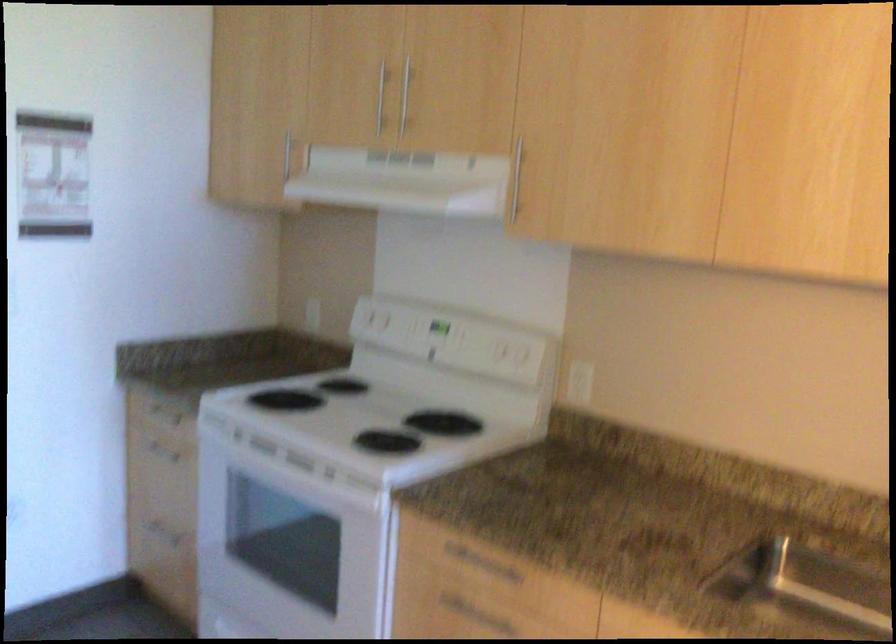
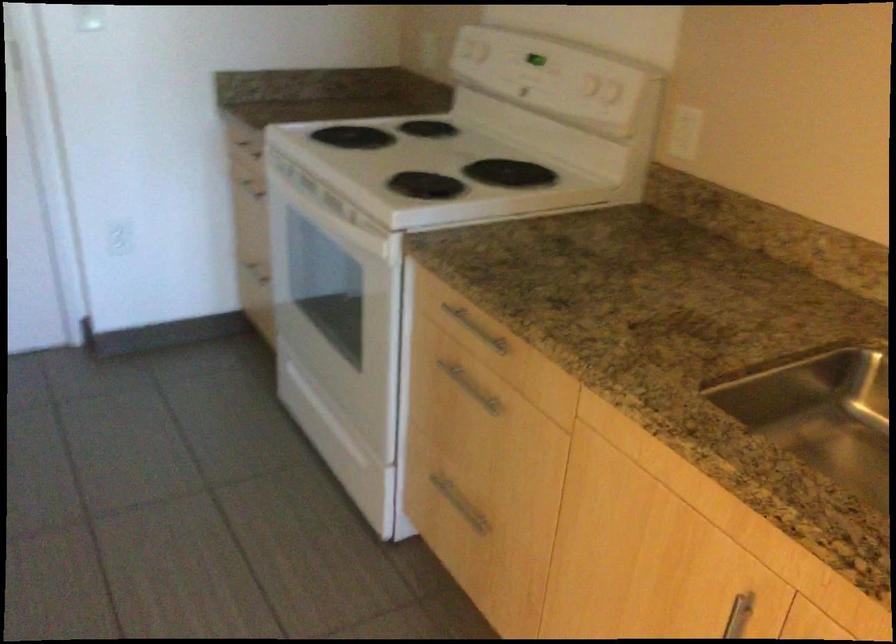
The first image is from the beginning of the video and the second image is from the end. How did the camera likely rotate when shooting the video?

The camera's rotation is toward left-down.